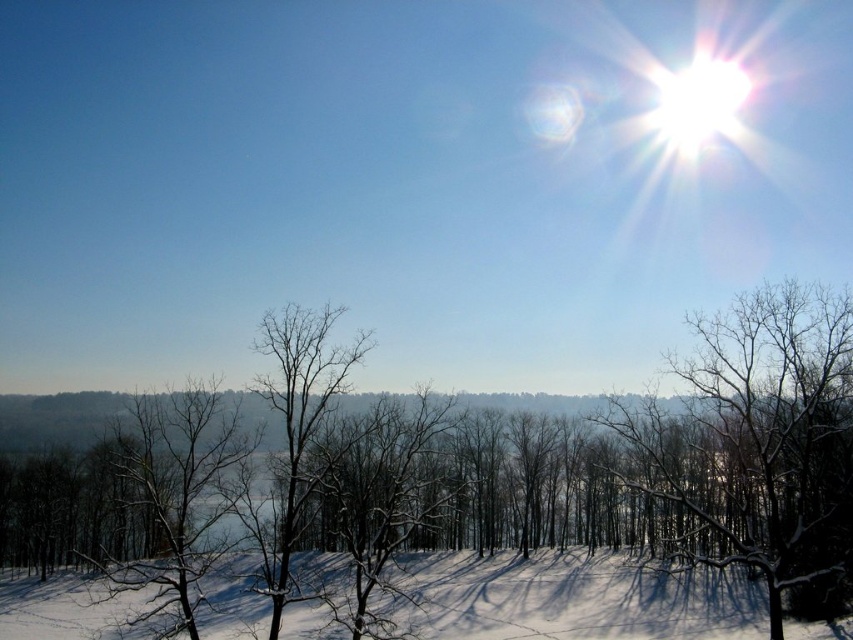
Is snowy bare tree at center to the left of white snow at lower center from the viewer's perspective?

Yes, snowy bare tree at center is to the left of white snow at lower center.

Does snowy bare tree at center appear over white snow at lower center?

Correct, snowy bare tree at center is located above white snow at lower center.

Is point (358, 524) positioned before point (44, 611)?

That is True.

Image resolution: width=853 pixels, height=640 pixels. In order to click on snowy bare tree at center in this screenshot , I will do `click(453, 483)`.

Can you confirm if snow-covered branches at right is positioned below white snow at lower center?

No, snow-covered branches at right is not below white snow at lower center.

Locate an element on the screen. snow-covered branches at right is located at coordinates (758, 435).

You are a GUI agent. You are given a task and a screenshot of the screen. Output one action in this format:
    pyautogui.click(x=<x>, y=<y>)
    Task: Click on the snow-covered branches at right
    This screenshot has width=853, height=640.
    Given the screenshot: What is the action you would take?
    pyautogui.click(x=758, y=435)

Does snowy bare tree at center appear on the right side of snow-covered branches at right?

No, snowy bare tree at center is not to the right of snow-covered branches at right.

Between snowy bare tree at center and snow-covered branches at right, which one appears on the right side from the viewer's perspective?

snow-covered branches at right

This screenshot has width=853, height=640. Find the location of `snowy bare tree at center`. snowy bare tree at center is located at coordinates (453, 483).